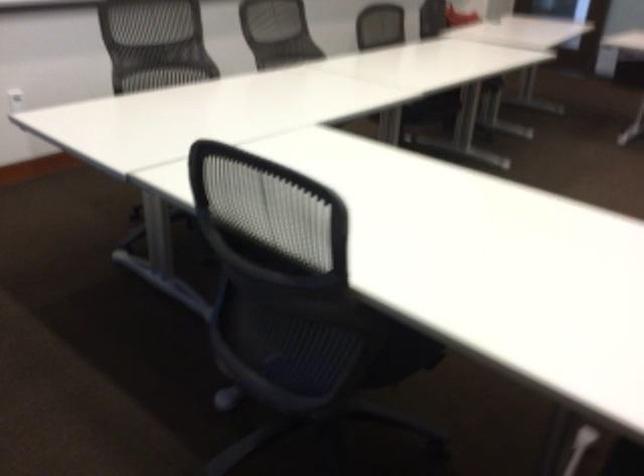
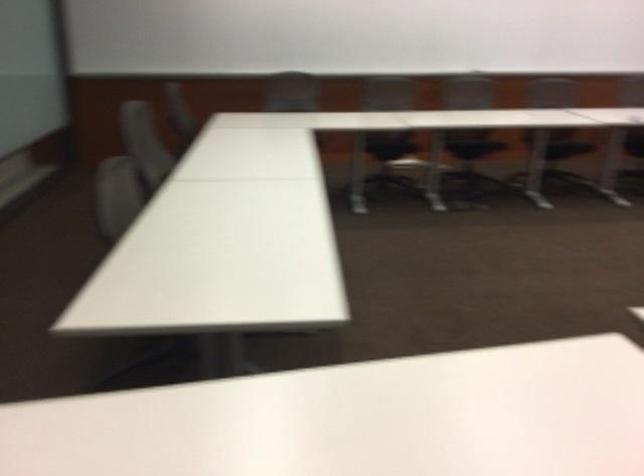
Based on the continuous images, in which direction is the camera rotating?

The camera's rotation is toward right-down.